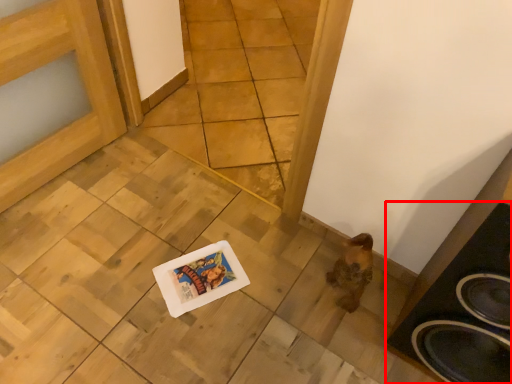
Question: Considering the relative positions of speaker (annotated by the red box) and tile in the image provided, where is speaker (annotated by the red box) located with respect to the staircase?

Choices:
 (A) right
 (B) left

Answer: (A)